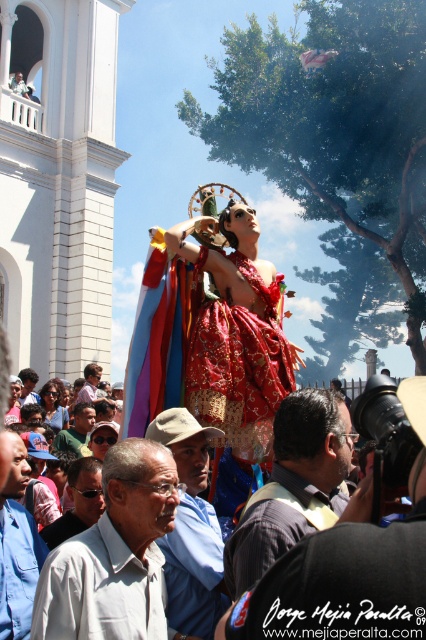
From the picture: Is brown fabric hat at center smaller than blue shirt at center?

Incorrect, brown fabric hat at center is not smaller in size than blue shirt at center.

Looking at this image, who is shorter, brown fabric hat at center or blue shirt at center?

With less height is blue shirt at center.

Who is more distant from viewer, [184,545] or [36,376]?

Point [36,376]

Locate an element on the screen. Image resolution: width=426 pixels, height=640 pixels. brown fabric hat at center is located at coordinates (190, 529).

Is blue denim shirt at lower left behind sunglassesmaterial at lower left?

Result: No, it is in front of sunglassesmaterial at lower left.

Is point (31, 547) farther from camera compared to point (51, 524)?

No, (31, 547) is in front of (51, 524).

Locate an element on the screen. The image size is (426, 640). blue denim shirt at lower left is located at coordinates (17, 548).

Between gray fabric shirt at lower left and green shirt at center, which one has less height?

green shirt at center

Is point (158, 609) closer to viewer compared to point (85, 404)?

Yes, it is.

Between point (109, 611) and point (54, 444), which one is positioned in front?

Point (109, 611) is more forward.

Find the location of a particular element. The width and height of the screenshot is (426, 640). gray fabric shirt at lower left is located at coordinates point(114,556).